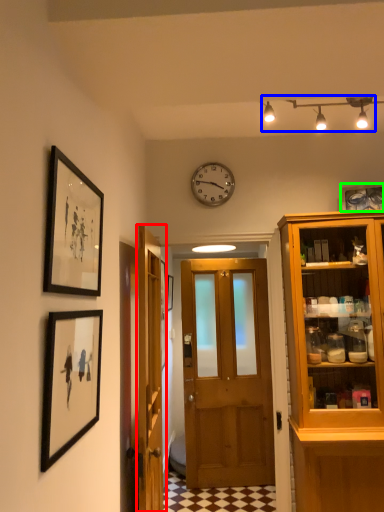
Question: Which is nearer to the door (highlighted by a red box)? light fixture (highlighted by a blue box) or picture frame (highlighted by a green box).

Choices:
 (A) light fixture
 (B) picture frame

Answer: (A)